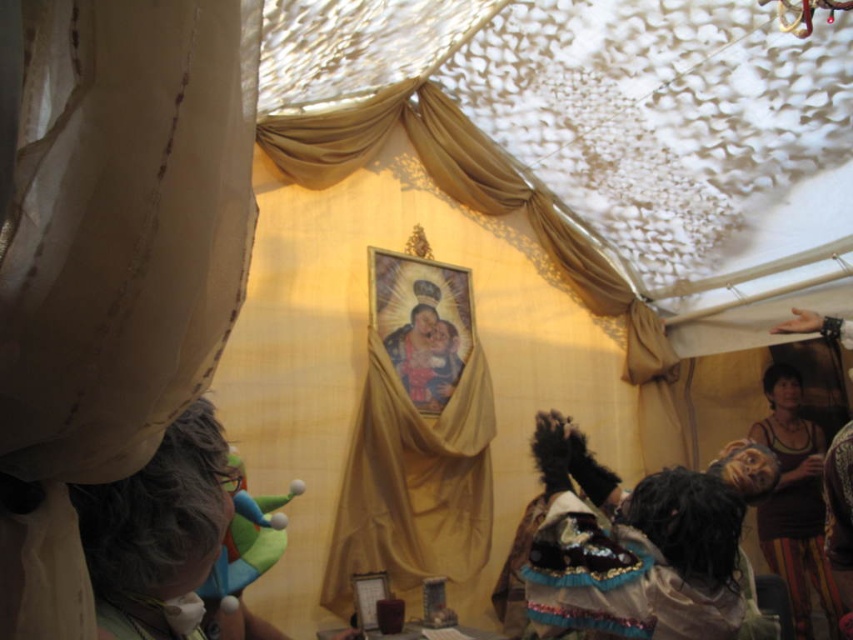
Measure the distance between translucent beige curtain at left and gold satin curtain at center.

translucent beige curtain at left is 3.10 meters from gold satin curtain at center.

In the scene shown: Is translucent beige curtain at left shorter than gold satin curtain at center?

Correct, translucent beige curtain at left is not as tall as gold satin curtain at center.

You are a GUI agent. You are given a task and a screenshot of the screen. Output one action in this format:
    pyautogui.click(x=<x>, y=<y>)
    Task: Click on the translucent beige curtain at left
    
    Given the screenshot: What is the action you would take?
    pyautogui.click(x=114, y=262)

Can you confirm if gold satin curtain at center is positioned to the left of black fabric at right?

Indeed, gold satin curtain at center is positioned on the left side of black fabric at right.

Can you confirm if gold satin curtain at center is positioned below black fabric at right?

Actually, gold satin curtain at center is above black fabric at right.

Which is in front, point (468, 570) or point (804, 561)?

Point (804, 561) is in front.

The height and width of the screenshot is (640, 853). Identify the location of gold satin curtain at center. (413, 483).

How far apart are translucent beige curtain at left and black fabric at right?

3.98 meters

Who is positioned more to the left, translucent beige curtain at left or black fabric at right?

Positioned to the left is translucent beige curtain at left.

At what (x,y) coordinates should I click in order to perform the action: click on translucent beige curtain at left. Please return your answer as a coordinate pair (x, y). Looking at the image, I should click on (114, 262).